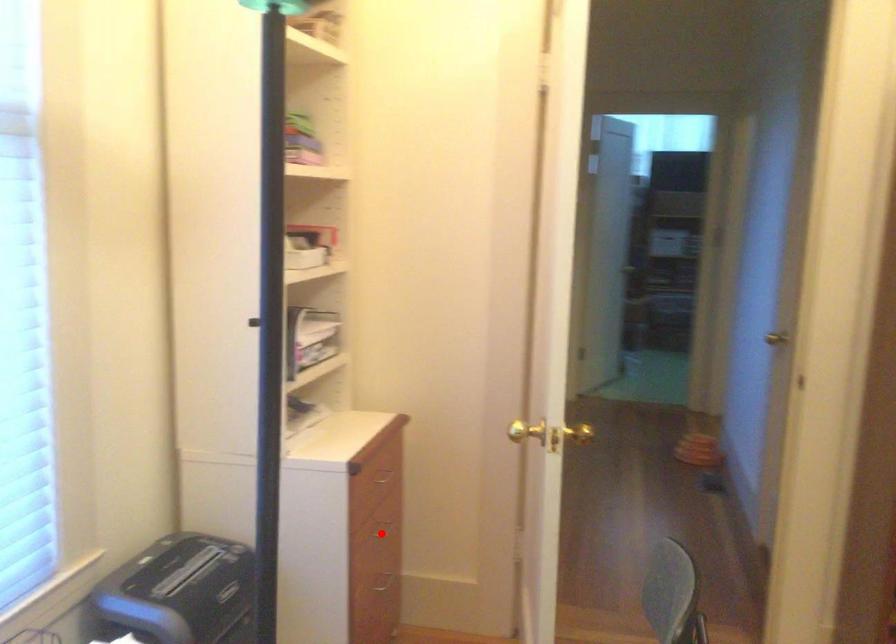
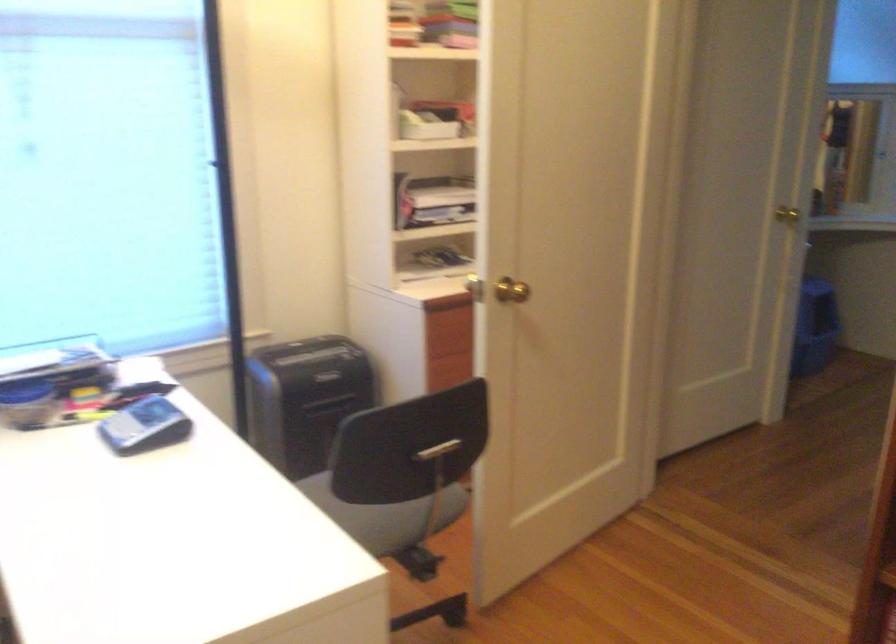
Question: I am providing you with two images of the same scene from different viewpoints. A red point is marked on the first image. At the location where the point appears in image 1, is it still visible in image 2?

Choices:
 (A) Yes
 (B) No

Answer: (B)